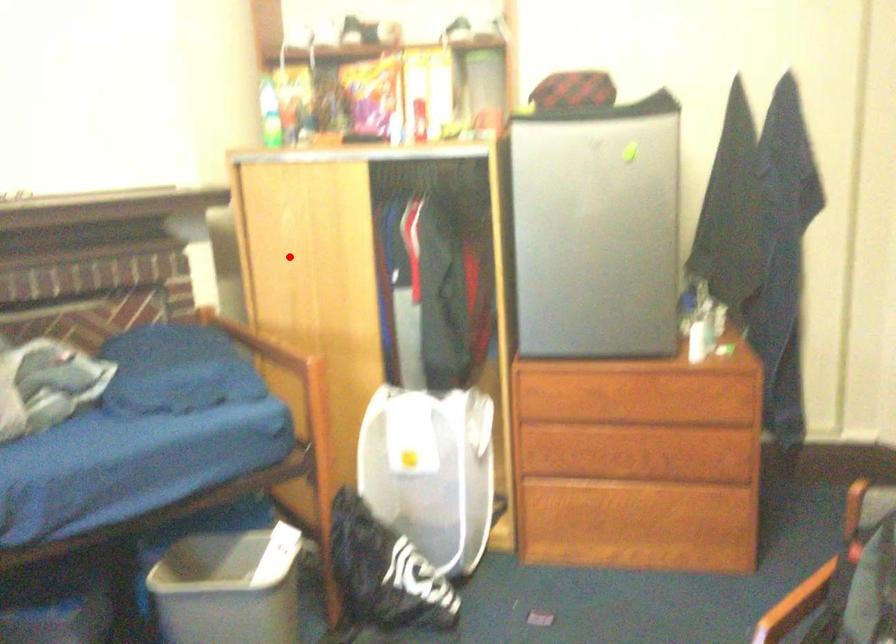
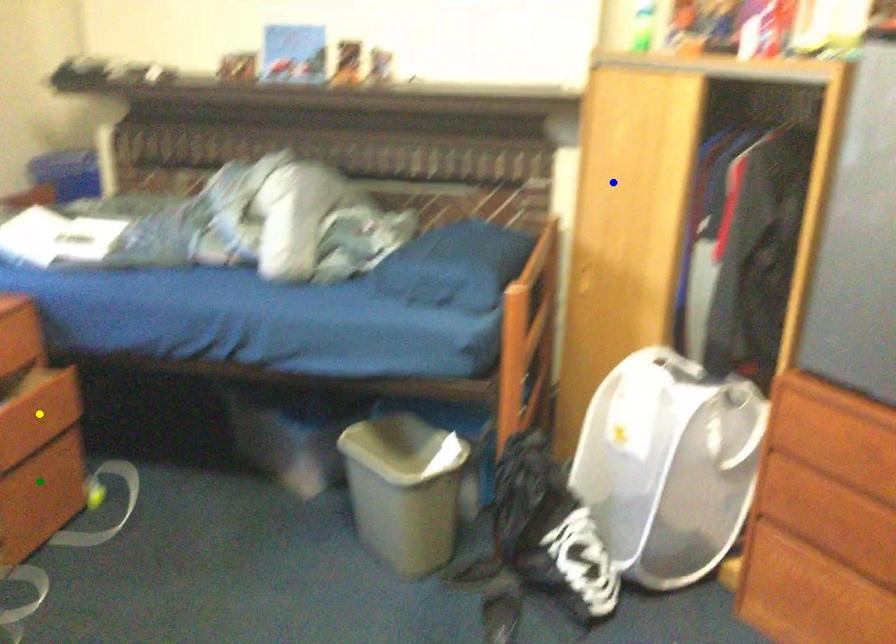
Question: I am providing you with two images of the same scene from different viewpoints. A red point is marked on the first image. You are given multiple points on the second image. Which point in image 2 represents the same 3d spot as the red point in image 1?

Choices:
 (A) green point
 (B) yellow point
 (C) blue point

Answer: (C)